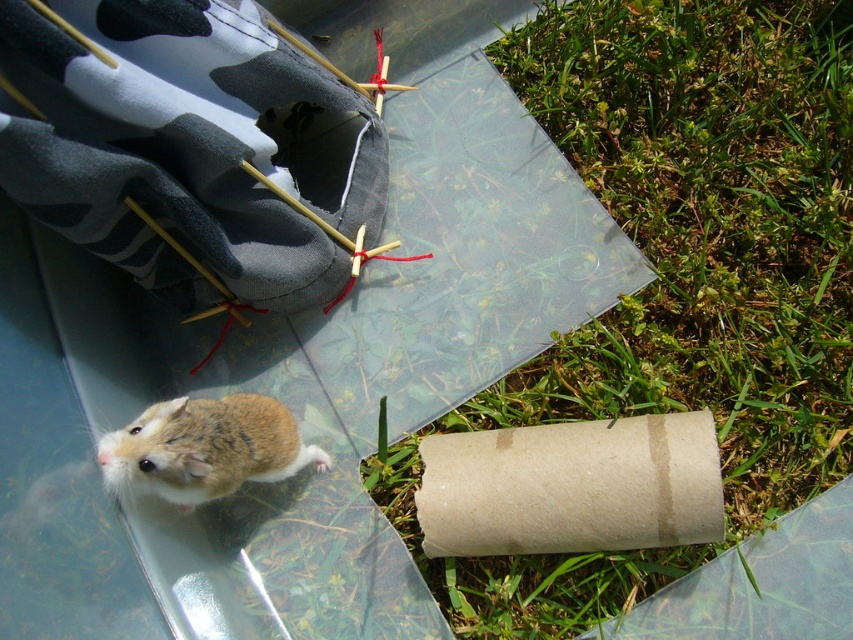
You are a small insect trying to reach the brown cardboard tube at lower right from the green grass at lower right. Which direction should you move to get closer to the tube?

The green grass at lower right is further to the viewer than brown cardboard tube at lower right, so the insect should move backward to get closer to the tube.

You are a hamster in the enclosure and want to reach the green grass at lower right. What direction should you move in to get there?

The green grass at lower right is located at point (677, 278), so the hamster should move towards the lower right direction to reach it.